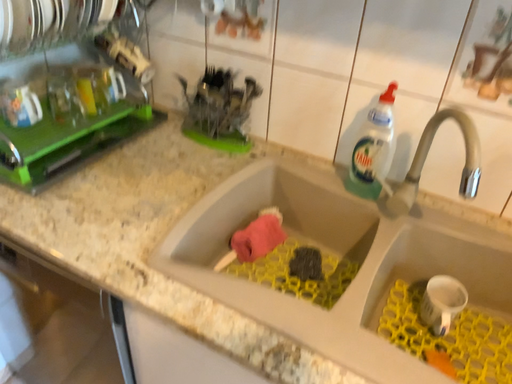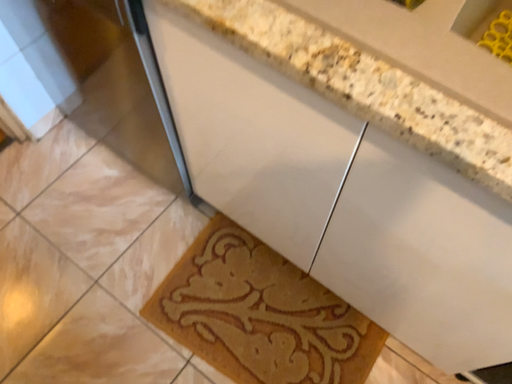
Question: How did the camera likely rotate when shooting the video?

Choices:
 (A) rotated downward
 (B) rotated upward

Answer: (A)